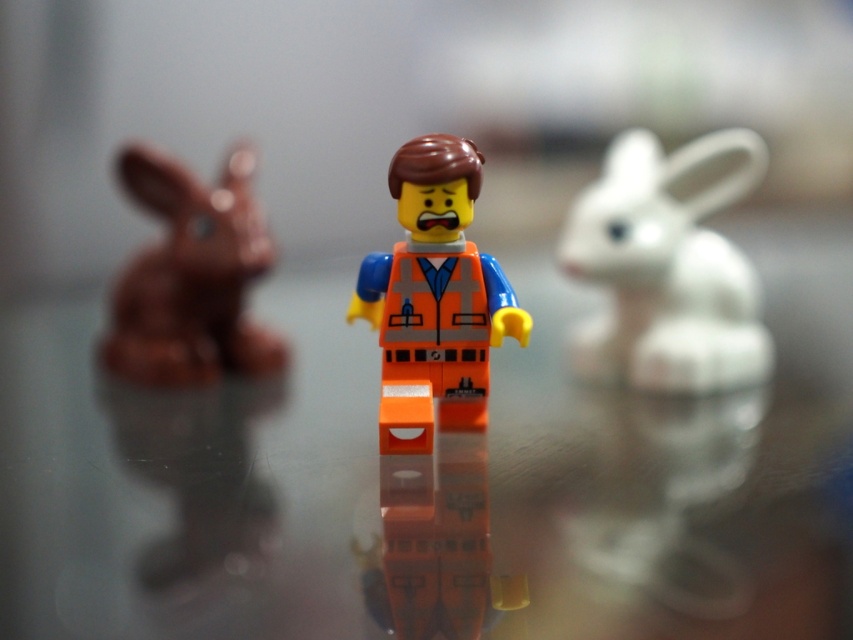
Question: Among these objects, which one is nearest to the camera?

Choices:
 (A) orange matte/soft plastic minifigure at center
 (B) matte brown bunny at left
 (C) white matte rabbit at right

Answer: (A)

Question: Is white matte rabbit at right smaller than orange matte/soft plastic minifigure at center?

Choices:
 (A) no
 (B) yes

Answer: (A)

Question: Does orange matte/soft plastic minifigure at center have a lesser width compared to matte brown bunny at left?

Choices:
 (A) no
 (B) yes

Answer: (B)

Question: Considering the relative positions of orange matte/soft plastic minifigure at center and matte brown bunny at left in the image provided, where is orange matte/soft plastic minifigure at center located with respect to matte brown bunny at left?

Choices:
 (A) right
 (B) left

Answer: (A)

Question: Which object is farther from the camera taking this photo?

Choices:
 (A) white matte rabbit at right
 (B) orange matte/soft plastic minifigure at center
 (C) matte brown bunny at left

Answer: (C)

Question: Which point is farther to the camera?

Choices:
 (A) white matte rabbit at right
 (B) orange matte/soft plastic minifigure at center
 (C) matte brown bunny at left

Answer: (C)